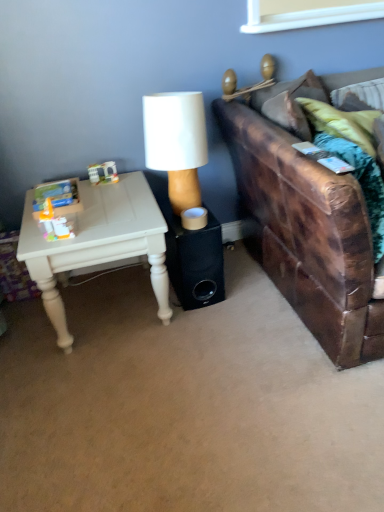
Question: Does white matte lamp at center have a lesser height compared to brown leather couch at right?

Choices:
 (A) no
 (B) yes

Answer: (B)

Question: Is white matte lamp at center wider than brown leather couch at right?

Choices:
 (A) no
 (B) yes

Answer: (A)

Question: From a real-world perspective, is white matte lamp at center below brown leather couch at right?

Choices:
 (A) no
 (B) yes

Answer: (A)

Question: Is white matte lamp at center positioned before brown leather couch at right?

Choices:
 (A) no
 (B) yes

Answer: (A)

Question: Is brown leather couch at right a part of white matte lamp at center?

Choices:
 (A) yes
 (B) no

Answer: (B)

Question: Could you tell me if white matte lamp at center is turned towards brown leather couch at right?

Choices:
 (A) no
 (B) yes

Answer: (A)

Question: Considering the relative sizes of white painted wood table at left and white matte lamp at center in the image provided, is white painted wood table at left shorter than white matte lamp at center?

Choices:
 (A) no
 (B) yes

Answer: (A)

Question: Can you confirm if white painted wood table at left is positioned to the left of white matte lamp at center?

Choices:
 (A) no
 (B) yes

Answer: (B)

Question: Does white painted wood table at left appear on the right side of white matte lamp at center?

Choices:
 (A) no
 (B) yes

Answer: (A)

Question: Is white painted wood table at left facing towards white matte lamp at center?

Choices:
 (A) no
 (B) yes

Answer: (A)

Question: Considering the relative sizes of white painted wood table at left and white matte lamp at center in the image provided, is white painted wood table at left taller than white matte lamp at center?

Choices:
 (A) no
 (B) yes

Answer: (B)

Question: Is white painted wood table at left further to camera compared to white matte lamp at center?

Choices:
 (A) yes
 (B) no

Answer: (B)

Question: Is white painted wood table at left in contact with brown leather couch at right?

Choices:
 (A) no
 (B) yes

Answer: (A)